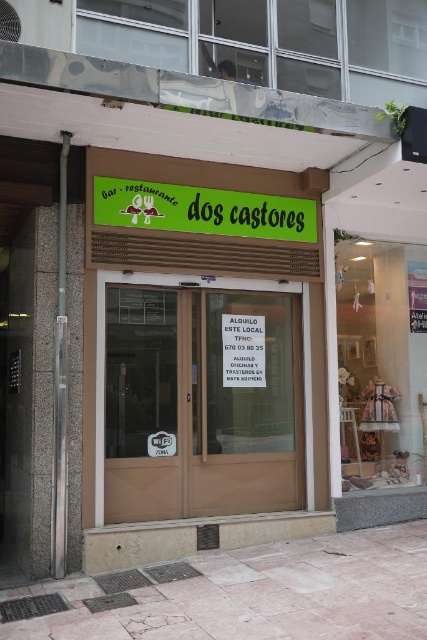
You are a delivery person trying to find the entrance to Dos Castores. You see the green matte signboard at upper center and the white paper sign at center. Which sign is wider?

The green matte signboard at upper center is wider than the white paper sign at center.